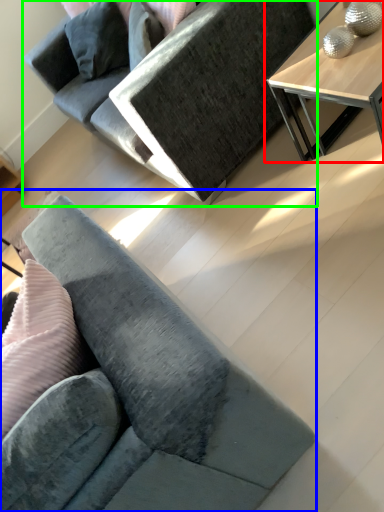
Question: Which object is positioned farthest from table (highlighted by a red box)? Select from studio couch (highlighted by a blue box) and studio couch (highlighted by a green box).

Choices:
 (A) studio couch
 (B) studio couch

Answer: (A)